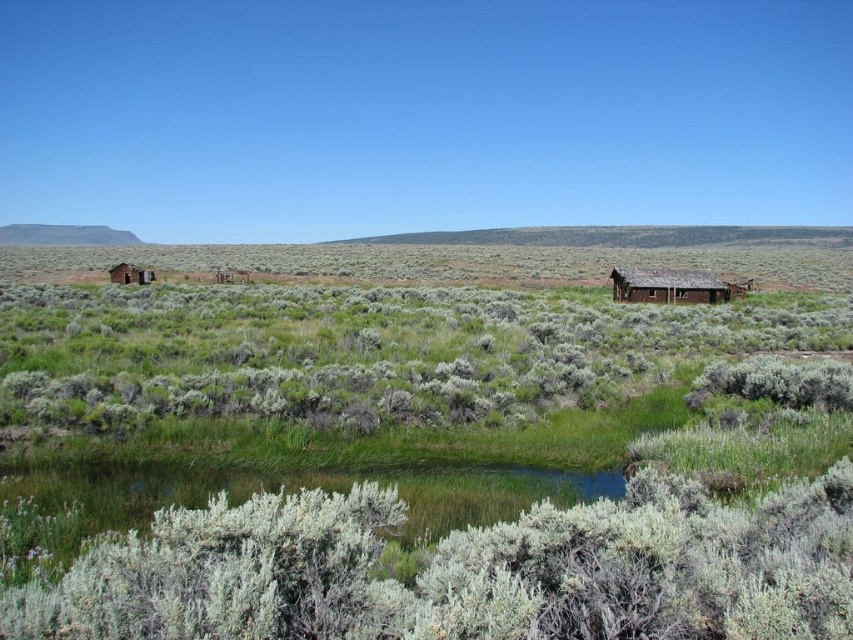
Question: Which point is farther to the camera?

Choices:
 (A) (685, 284)
 (B) (136, 276)

Answer: (B)

Question: Is weathered wood hut at right wider than rustic wooden hut at left?

Choices:
 (A) no
 (B) yes

Answer: (B)

Question: In this image, where is weathered wood hut at right located relative to rustic wooden hut at left?

Choices:
 (A) below
 (B) above

Answer: (A)

Question: Considering the relative positions of weathered wood hut at right and rustic wooden hut at left in the image provided, where is weathered wood hut at right located with respect to rustic wooden hut at left?

Choices:
 (A) left
 (B) right

Answer: (B)